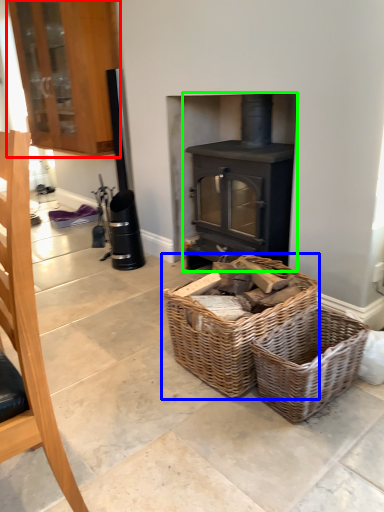
Question: Which is farther away from cabinetry (highlighted by a red box)? picnic basket (highlighted by a blue box) or wood burning stove (highlighted by a green box)?

Choices:
 (A) picnic basket
 (B) wood burning stove

Answer: (A)